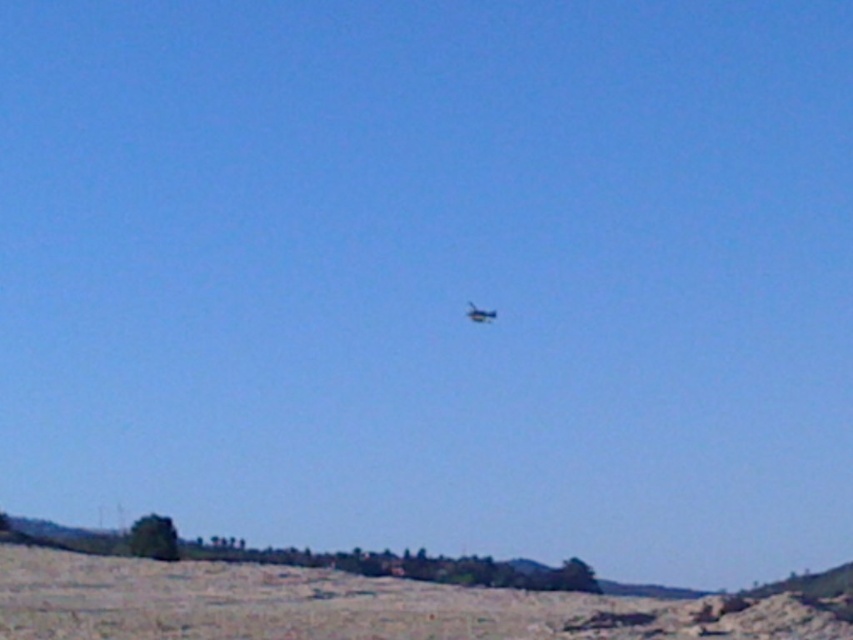
Can you confirm if metallic blue helicopter at center is thinner than shiny blue airplane at center?

In fact, metallic blue helicopter at center might be wider than shiny blue airplane at center.

Does point (479, 310) come closer to viewer compared to point (479, 310)?

Yes, it is in front of point (479, 310).

The height and width of the screenshot is (640, 853). What do you see at coordinates (479, 314) in the screenshot? I see `metallic blue helicopter at center` at bounding box center [479, 314].

Where is `metallic blue helicopter at center`? This screenshot has height=640, width=853. metallic blue helicopter at center is located at coordinates (479, 314).

Who is higher up, brown sandy dirt field at lower center or shiny blue airplane at center?

shiny blue airplane at center is above.

Can you confirm if brown sandy dirt field at lower center is positioned above shiny blue airplane at center?

No, brown sandy dirt field at lower center is not above shiny blue airplane at center.

Between point (490, 621) and point (490, 316), which one is positioned in front?

Point (490, 621)

This screenshot has width=853, height=640. I want to click on brown sandy dirt field at lower center, so click(355, 605).

Does brown sandy dirt field at lower center have a larger size compared to metallic blue helicopter at center?

Correct, brown sandy dirt field at lower center is larger in size than metallic blue helicopter at center.

This screenshot has width=853, height=640. I want to click on brown sandy dirt field at lower center, so click(355, 605).